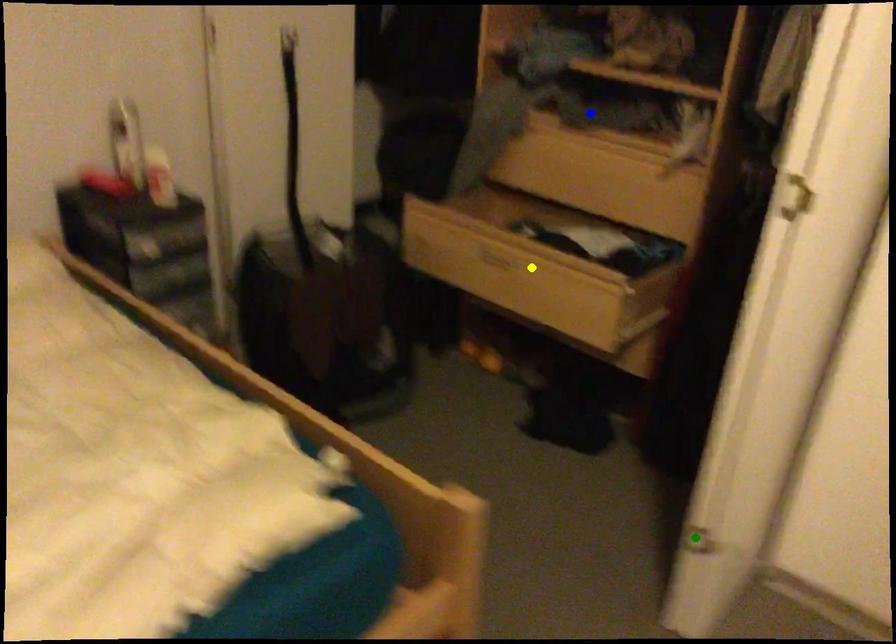
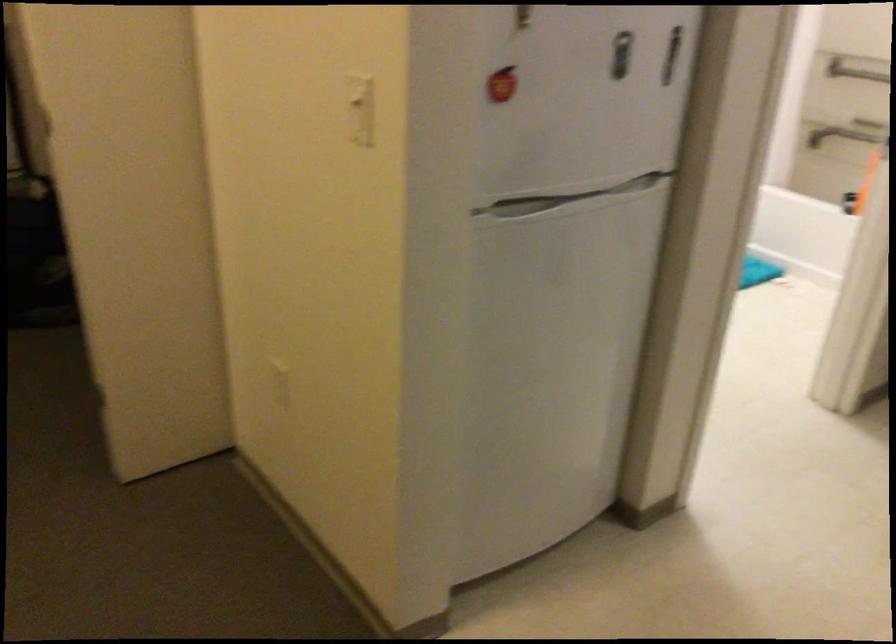
I am providing you with two images of the same scene from different viewpoints. Three points are marked in image1. Which point corresponds to a part or object that is occluded in image2?In image1, three points are marked. Which of them correspond to a part or object that is occluded in image2?Among the three points shown in image1, which one corresponds to a part or object that is no longer visible due to occlusion in image2?

Invisible in image2: blue point, yellow point, green point.